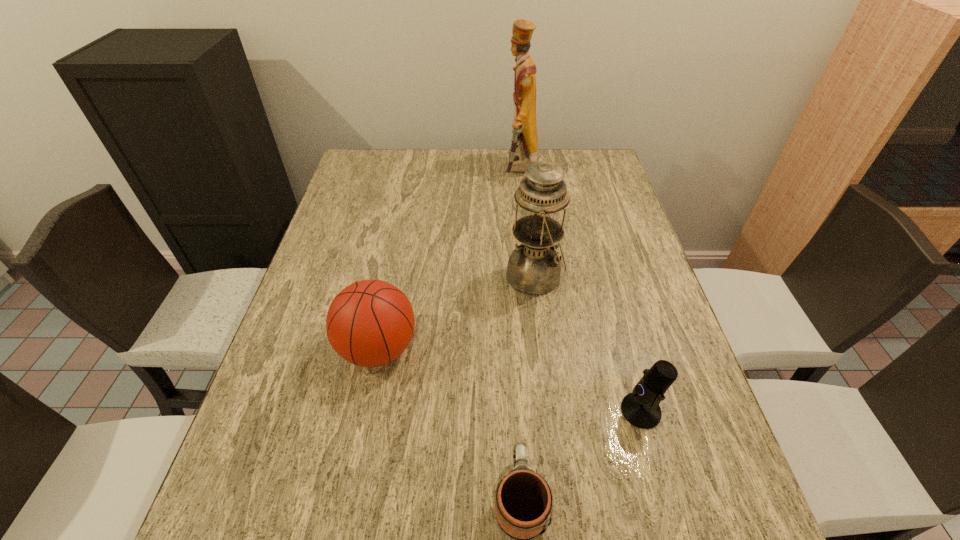
Identify the location of object identified as the third closest to the mug. The image size is (960, 540). (534, 268).